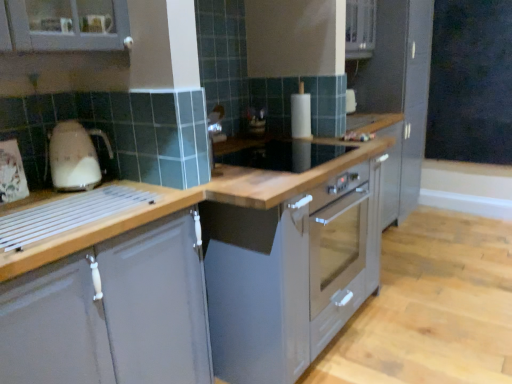
This screenshot has width=512, height=384. I want to click on blank space to the left of white paper towel holder at center, so click(274, 139).